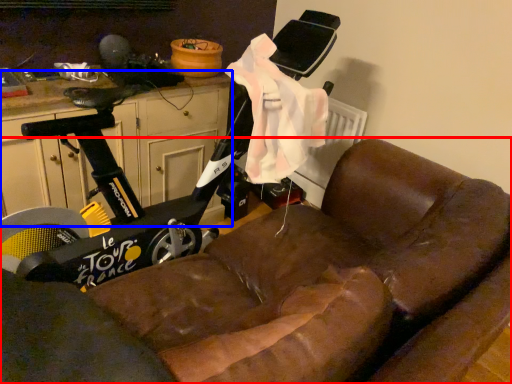
Question: Which of the following is the closest to the observer, studio couch (highlighted by a red box) or dresser (highlighted by a blue box)?

Choices:
 (A) studio couch
 (B) dresser

Answer: (A)